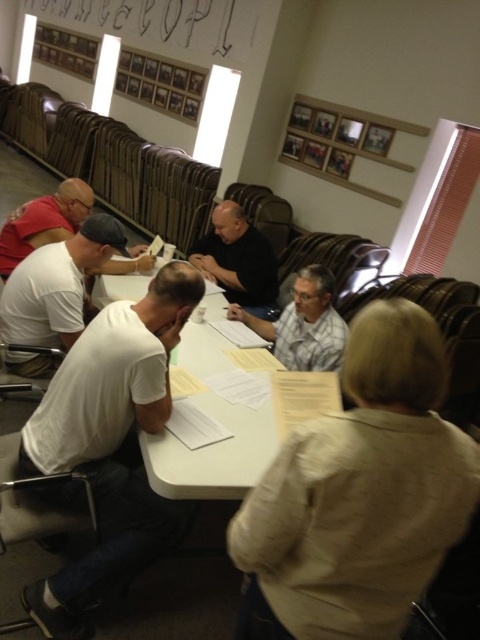
You are standing at the entrance of the meeting room and see two points marked on the floor. The first point is at position point (124, 305) and the second point is at position point (132, 248). Which point is closer to you?

Point (124, 305) is in front of point (132, 248), so it is closer to you.